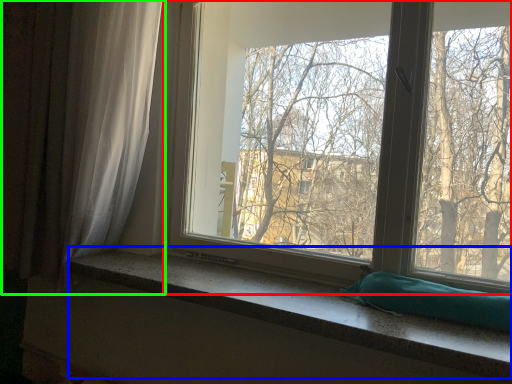
Question: Which is farther away from window (highlighted by a red box)? window sill (highlighted by a blue box) or curtain (highlighted by a green box)?

Choices:
 (A) window sill
 (B) curtain

Answer: (A)